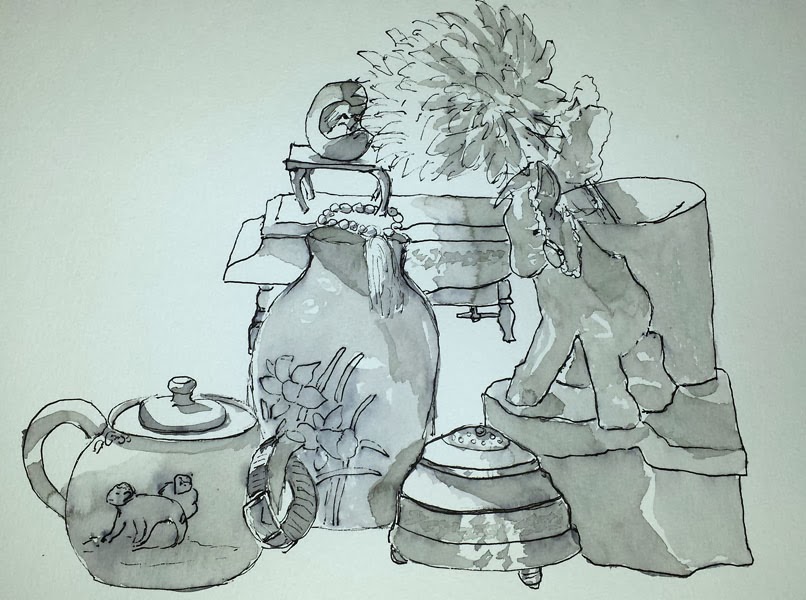
This screenshot has height=600, width=806. Identify the location of teapot lid. (190, 411).